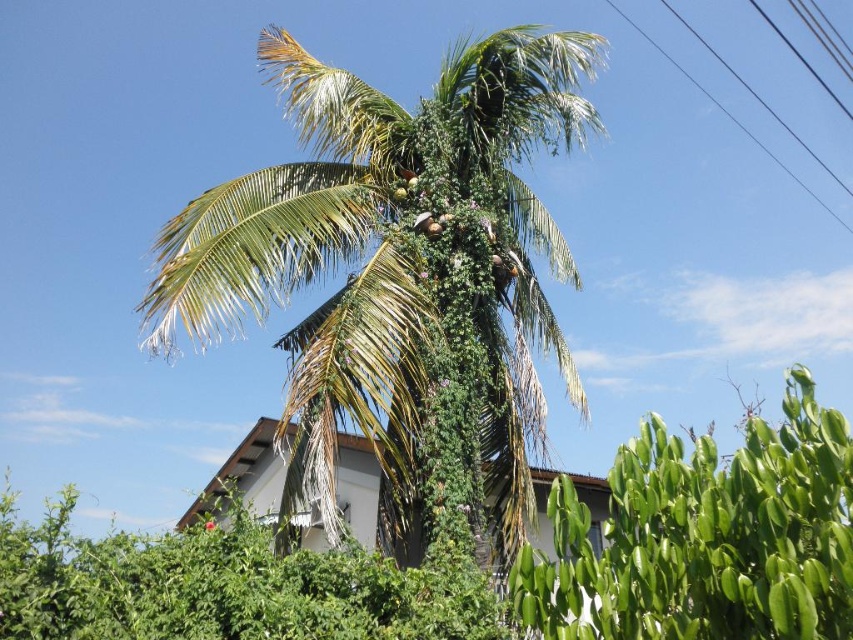
You are standing in a garden and want to take a photo of the green leafy coconut tree at center. If your camera can focus on objects up to 6 meters away, will you need to move closer or farther away to get a clear shot?

The green leafy coconut tree at center is 6.80 meters from viewer. Since the camera can focus up to 6 meters, you need to move closer to ensure it is within the 6 meters range for clear focus.

You are standing in a garden and see the green leafy coconut tree at center and the green leafy bush at lower left. Which one is positioned to the right side of the other?

The green leafy coconut tree at center is positioned to the right of the green leafy bush at lower left.